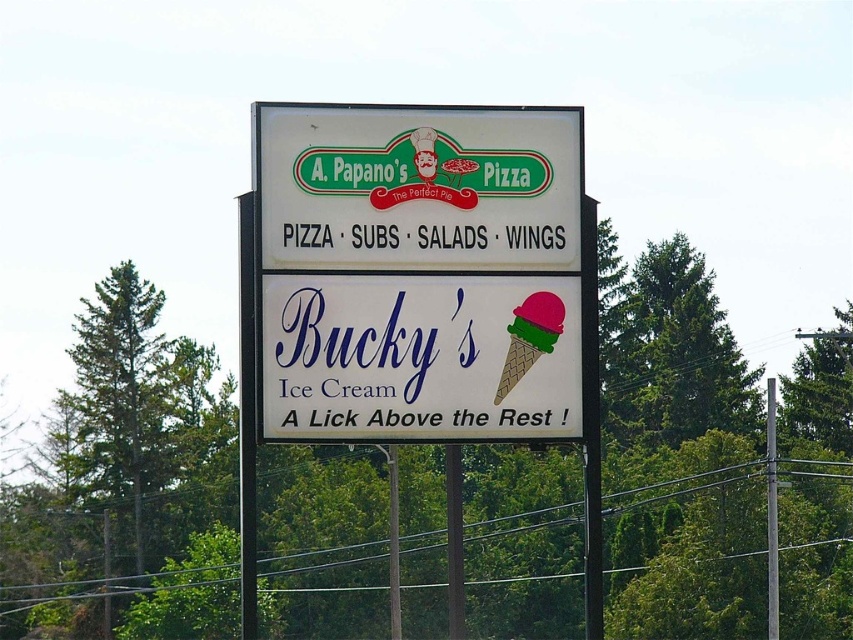
Question: Which of the following is the closest to the observer?

Choices:
 (A) white paper sign at center
 (B) green matte ice cream cone at center

Answer: (A)

Question: In this image, where is white paper sign at center located relative to green matte ice cream cone at center?

Choices:
 (A) left
 (B) right

Answer: (A)

Question: Which point appears closest to the camera in this image?

Choices:
 (A) (521, 259)
 (B) (546, 353)
 (C) (302, 339)

Answer: (C)

Question: Can you confirm if white paper sign at center is positioned below green matte ice cream cone at center?

Choices:
 (A) no
 (B) yes

Answer: (B)

Question: Is white paper sign at center thinner than green matte ice cream cone at center?

Choices:
 (A) no
 (B) yes

Answer: (A)

Question: Based on their relative distances, which object is farther from the white plastic sign at center?

Choices:
 (A) green matte ice cream cone at center
 (B) white paper sign at center

Answer: (A)